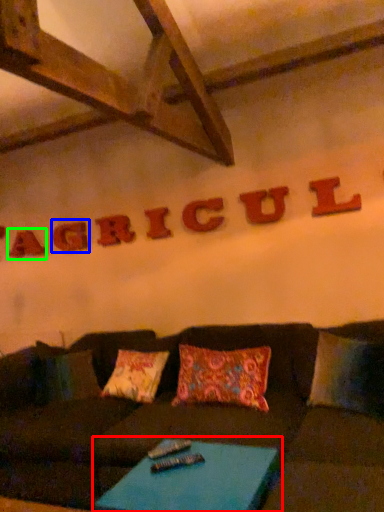
Question: Which object is the farthest from table (highlighted by a red box)? Choose among these: letter (highlighted by a blue box) or letter (highlighted by a green box).

Choices:
 (A) letter
 (B) letter

Answer: (B)